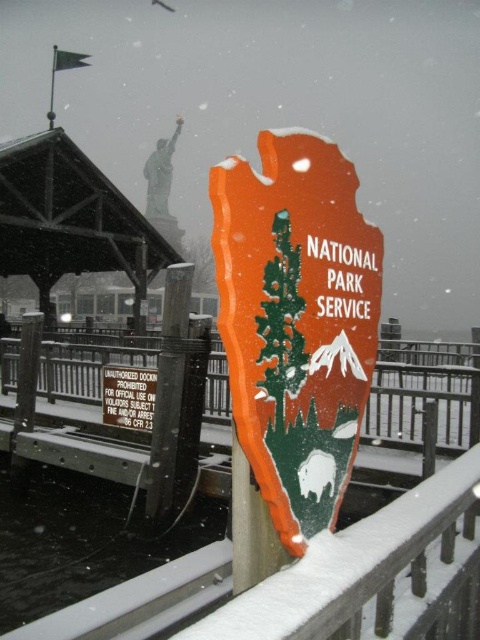
Identify the location of orange matte national park service sign at center. The image size is (480, 640). (296, 321).

Can you confirm if orange matte national park service sign at center is positioned to the right of wooden sign at center?

Yes, orange matte national park service sign at center is to the right of wooden sign at center.

Is point (226, 323) positioned before point (155, 384)?

Yes.

This screenshot has width=480, height=640. I want to click on orange matte national park service sign at center, so click(x=296, y=321).

Does orange matte national park service sign at center have a larger size compared to brushed metal pole at center?

Actually, orange matte national park service sign at center might be smaller than brushed metal pole at center.

From the picture: Who is positioned more to the left, orange matte national park service sign at center or brushed metal pole at center?

brushed metal pole at center is more to the left.

The image size is (480, 640). What do you see at coordinates (296, 321) in the screenshot?
I see `orange matte national park service sign at center` at bounding box center [296, 321].

What are the coordinates of `orange matte national park service sign at center` in the screenshot? It's located at (296, 321).

From the picture: Measure the distance between brushed metal pole at center and wooden sign at center.

5.07 feet

Is brushed metal pole at center above wooden sign at center?

Indeed, brushed metal pole at center is positioned over wooden sign at center.

Is point (163, 492) positioned in front of point (118, 401)?

Yes, it is.

I want to click on brushed metal pole at center, so click(x=168, y=388).